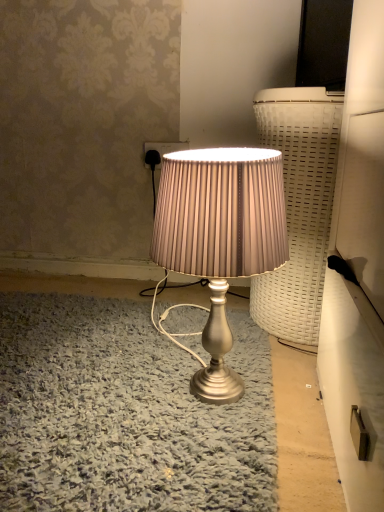
Question: Would you say satin silver lamp at center contains matte black socket at upper center?

Choices:
 (A) no
 (B) yes

Answer: (A)

Question: Can you confirm if satin silver lamp at center is positioned to the right of matte black socket at upper center?

Choices:
 (A) yes
 (B) no

Answer: (A)

Question: Can you confirm if satin silver lamp at center is bigger than matte black socket at upper center?

Choices:
 (A) no
 (B) yes

Answer: (B)

Question: Is satin silver lamp at center aimed at matte black socket at upper center?

Choices:
 (A) no
 (B) yes

Answer: (A)

Question: From a real-world perspective, is satin silver lamp at center located beneath matte black socket at upper center?

Choices:
 (A) yes
 (B) no

Answer: (A)

Question: Does satin silver lamp at center have a greater width compared to matte black socket at upper center?

Choices:
 (A) yes
 (B) no

Answer: (A)

Question: Does matte black socket at upper center have a greater width compared to satin silver lamp at center?

Choices:
 (A) no
 (B) yes

Answer: (A)

Question: Can you confirm if matte black socket at upper center is thinner than satin silver lamp at center?

Choices:
 (A) yes
 (B) no

Answer: (A)

Question: Is matte black socket at upper center facing away from satin silver lamp at center?

Choices:
 (A) no
 (B) yes

Answer: (A)

Question: Does matte black socket at upper center turn towards satin silver lamp at center?

Choices:
 (A) no
 (B) yes

Answer: (B)

Question: Are matte black socket at upper center and satin silver lamp at center making contact?

Choices:
 (A) no
 (B) yes

Answer: (A)

Question: Is the depth of matte black socket at upper center less than that of satin silver lamp at center?

Choices:
 (A) no
 (B) yes

Answer: (A)

Question: From the image's perspective, is satin silver lamp at center positioned above or below matte black socket at upper center?

Choices:
 (A) above
 (B) below

Answer: (B)